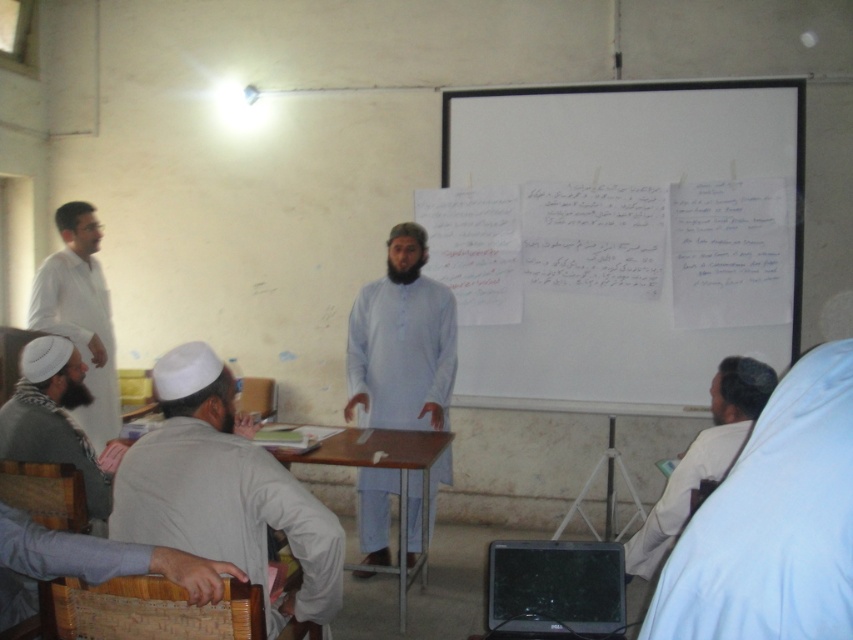
You are organizing a cultural event and need to place a decorative cloth on the table next to the bearded man in white robe at lower left. The cloth you have is the same size as the white cloth at lower right. Will the cloth be too large for the table?

The bearded man in white robe at lower left has a lesser width compared to the white cloth at lower right. Since the cloth you have is the same size as the white cloth at lower right, it might be too large for the table next to the bearded man in white robe at lower left.

You are a student in the classroom and need to decide which item is bigger between the white matte shirt at left and the white cloth at lower right. Which one should you choose?

The white cloth at lower right is bigger than the white matte shirt at left, so you should choose the white cloth at lower right.